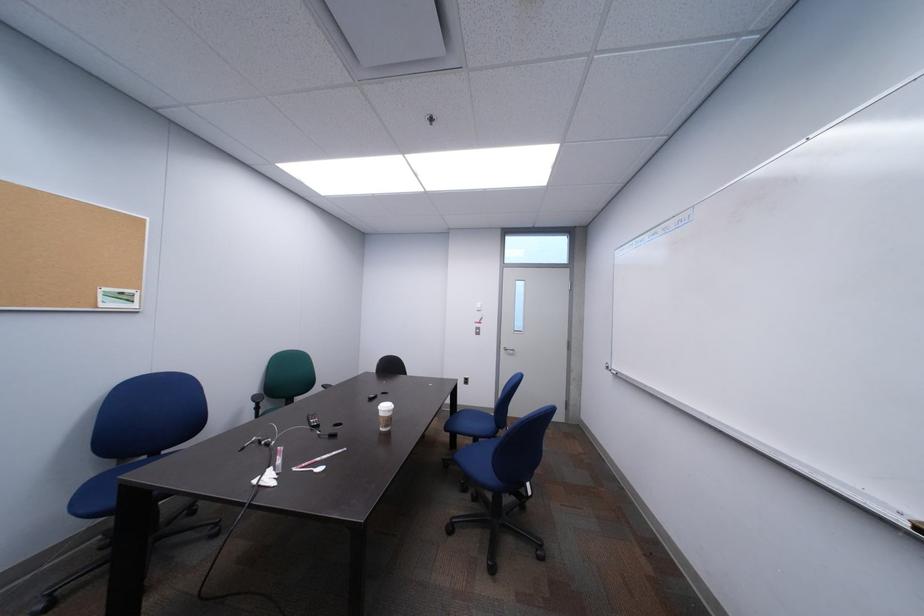
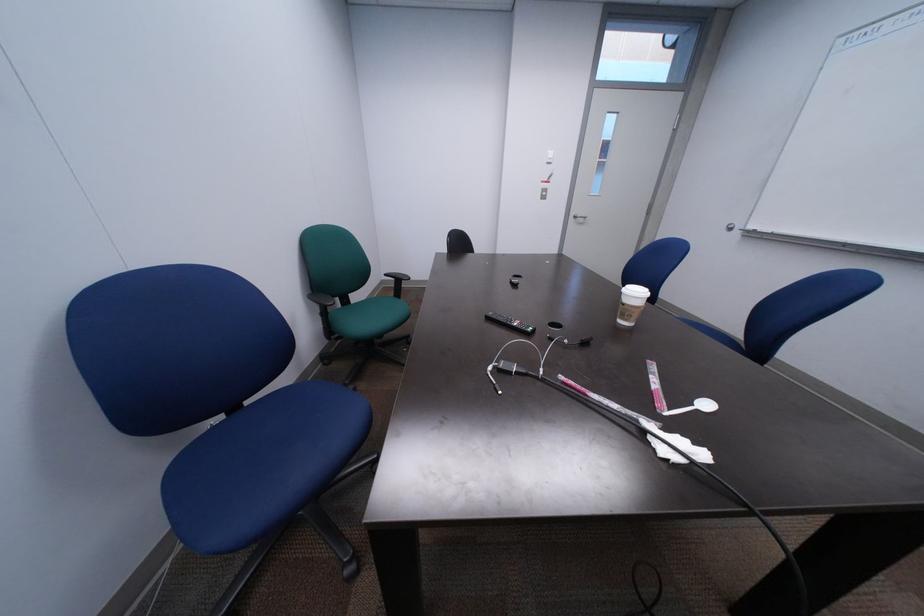
What movement of the cameraman would produce the second image?

The cameraman moved toward left, forward.